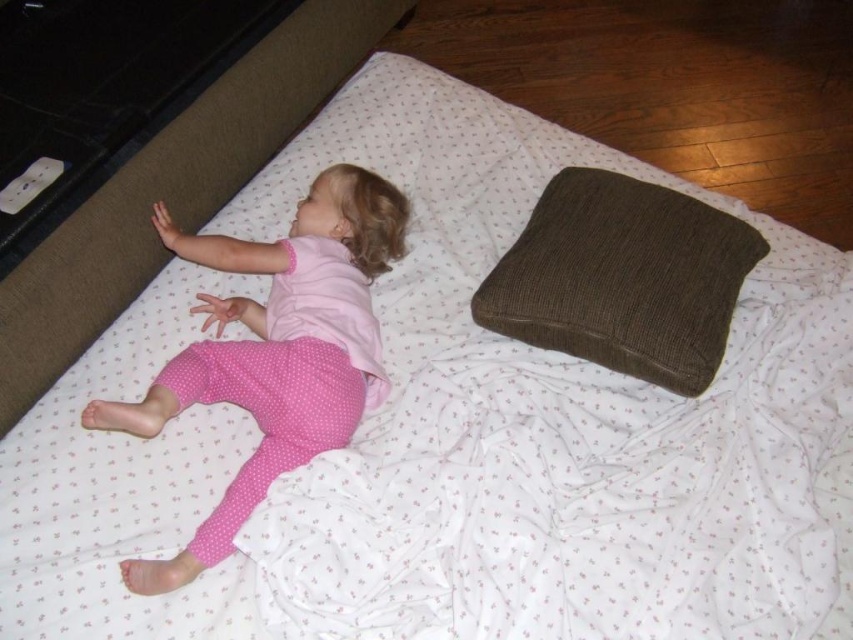
You are a parent checking on your child. You notice the pink polka dot pajamas at center and the brown corduroy pillow at upper right. Can you tell if the pillow is within arm reach of the pajamas?

The distance between the pink polka dot pajamas at center and the brown corduroy pillow at upper right is 15.39 inches. Since the average arm span of a child is around 20 inches, the pillow is within arm reach.

You are a photographer taking a picture of the scene. You want to focus on the pink polka dot pajamas at center and the brown corduroy pillow at upper right. Which object should you adjust your camera focus on first to ensure both are in focus?

You should focus on the brown corduroy pillow at upper right first because it is farther away from the viewer compared to the pink polka dot pajamas at center, ensuring depth of field captures both.

You are a parent checking on your child. You notice the pink polka dot pajamas at center and the brown corduroy pillow at upper right. Which item is closer to the left side of the bed?

The pink polka dot pajamas at center are to the left of the brown corduroy pillow at upper right, so they are closer to the left side of the bed.